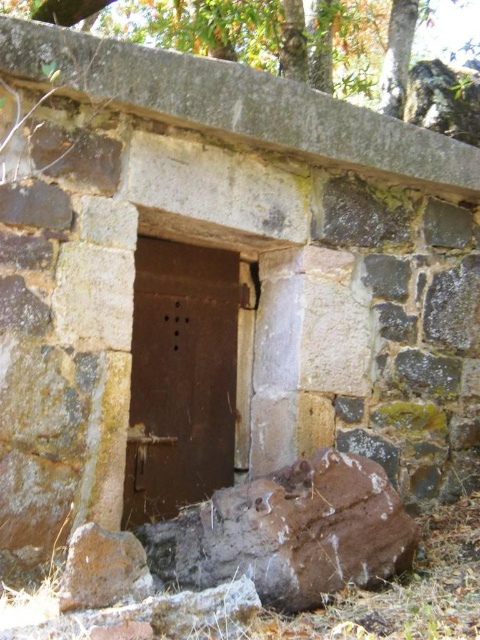
Question: Can you confirm if brown rough stone at lower center is bigger than rusty metal door at center?

Choices:
 (A) yes
 (B) no

Answer: (A)

Question: Estimate the real-world distances between objects in this image. Which object is farther from the brown rough stone at lower center?

Choices:
 (A) green leafy tree at upper center
 (B) rusty metal door at center

Answer: (A)

Question: Which of the following is the farthest from the observer?

Choices:
 (A) rusty metal door at center
 (B) brown rough stone at lower center
 (C) green leafy tree at upper center

Answer: (C)

Question: Does brown rough stone at lower center have a greater width compared to green leafy tree at upper center?

Choices:
 (A) yes
 (B) no

Answer: (B)

Question: Can you confirm if brown rough stone at lower center is wider than green leafy tree at upper center?

Choices:
 (A) yes
 (B) no

Answer: (B)

Question: Which of the following is the closest to the observer?

Choices:
 (A) rusty metal door at center
 (B) green leafy tree at upper center
 (C) brown rough stone at lower center

Answer: (C)